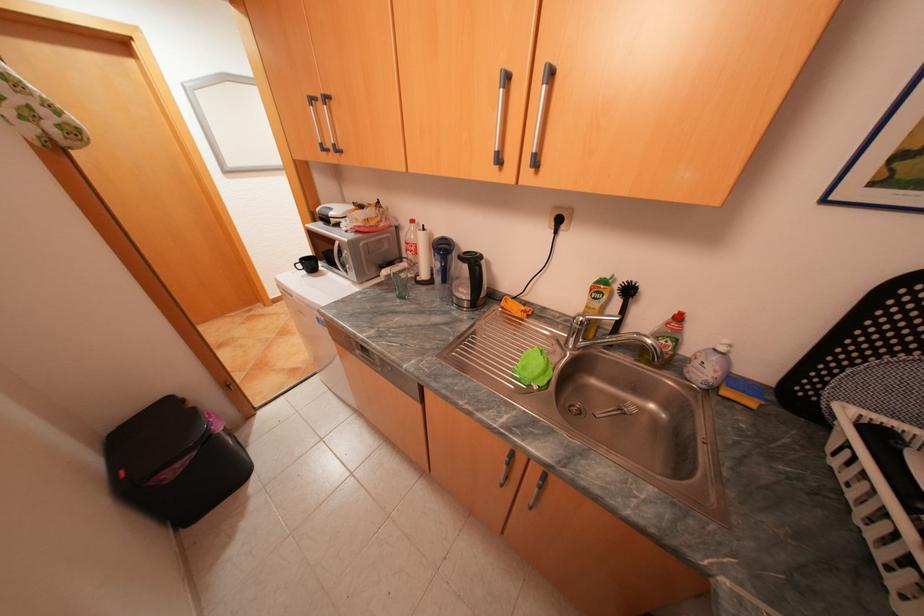
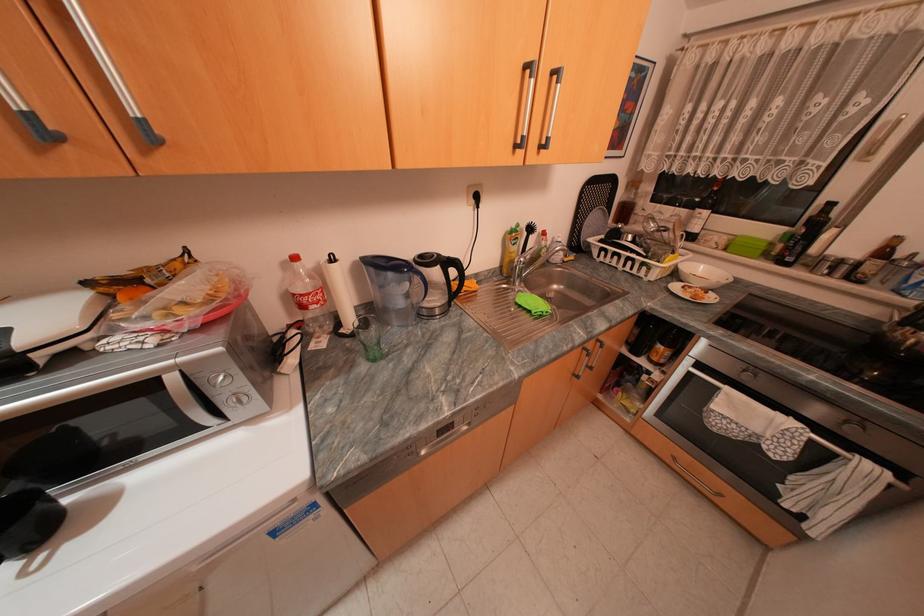
Locate, in the second image, the point that corresponds to point (346, 243) in the first image.

(181, 378)